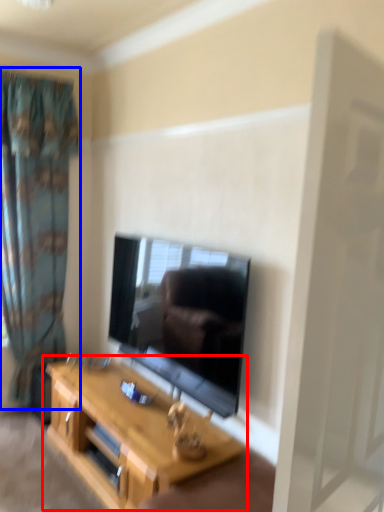
Question: Which of the following is the closest to the observer, table (highlighted by a red box) or curtain (highlighted by a blue box)?

Choices:
 (A) table
 (B) curtain

Answer: (A)